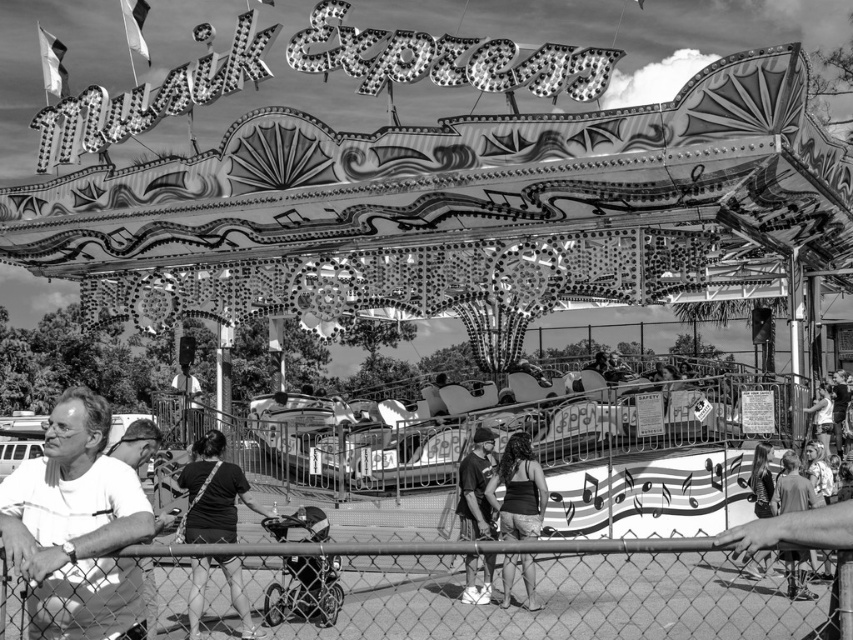
Consider the image. You are a photographer at the fairground and want to capture a photo of the Music Express ride. You notice a person wearing a white matte shirt at lower left and dark blue jeans at center. Which clothing item is located more to the left in the image?

The white matte shirt at lower left is positioned on the left side of dark blue jeans at center, so the white matte shirt at lower left is more to the left in the image.

You are a photographer trying to capture a clear shot of the Music Express ride. You notice a chain link fence at lower center and a dark gray fabric purse at lower center are blocking your view. Which object is bigger and might be more obstructive?

The chain link fence at lower center is larger than the dark gray fabric purse at lower center, so it is more obstructive.